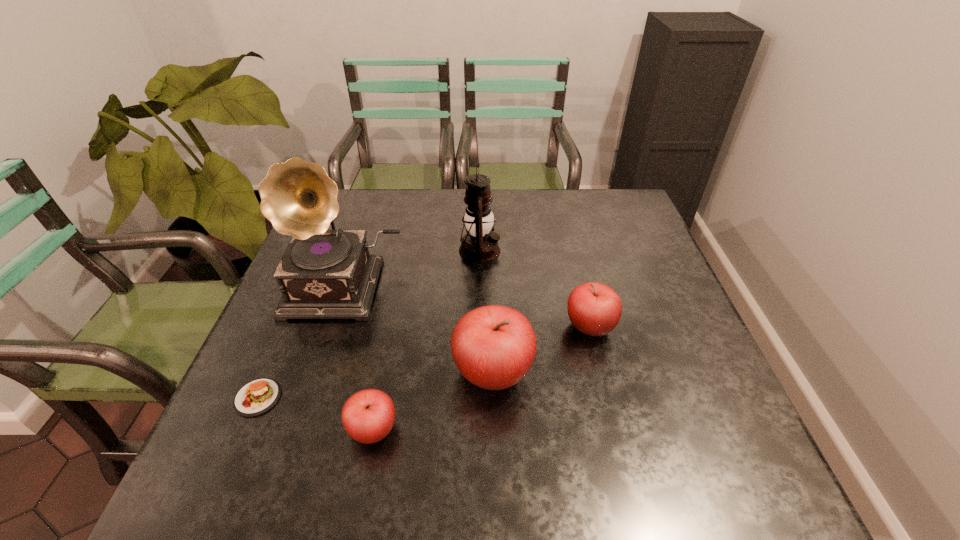
This screenshot has height=540, width=960. Identify the location of blank space located 0.090m on the left of the fourth shortest object. (410, 373).

You are a GUI agent. You are given a task and a screenshot of the screen. Output one action in this format:
    pyautogui.click(x=<x>, y=<y>)
    Task: Click on the free location located 0.220m on the left of the rightmost apple
    The image size is (960, 540).
    Given the screenshot: What is the action you would take?
    pyautogui.click(x=470, y=327)

This screenshot has width=960, height=540. What are the coordinates of `vacant space located 0.250m on the horn of the tallest object` in the screenshot? It's located at (301, 416).

The height and width of the screenshot is (540, 960). Identify the location of free location located on the side of the lantern, there is a wick adjustment knob. (603, 251).

Where is `vacant region located 0.140m on the back of the patty (food)`? vacant region located 0.140m on the back of the patty (food) is located at coordinates (287, 328).

Find the location of a particular element. This screenshot has height=540, width=960. patty (food) that is at the near edge is located at coordinates (256, 397).

Where is `record player that is at the left edge`? This screenshot has width=960, height=540. record player that is at the left edge is located at coordinates (323, 274).

Find the location of a particular element. patty (food) located at the left edge is located at coordinates (256, 397).

Locate an element on the screen. Image resolution: width=960 pixels, height=540 pixels. object that is positioned at the near left corner is located at coordinates (256, 397).

This screenshot has height=540, width=960. What are the coordinates of `vacant region at the far edge of the desktop` in the screenshot? It's located at (502, 215).